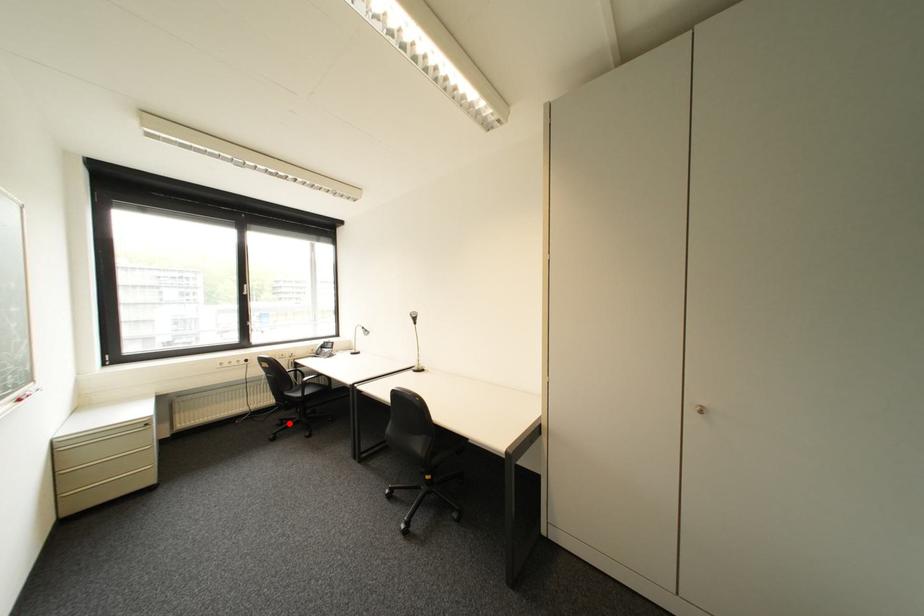
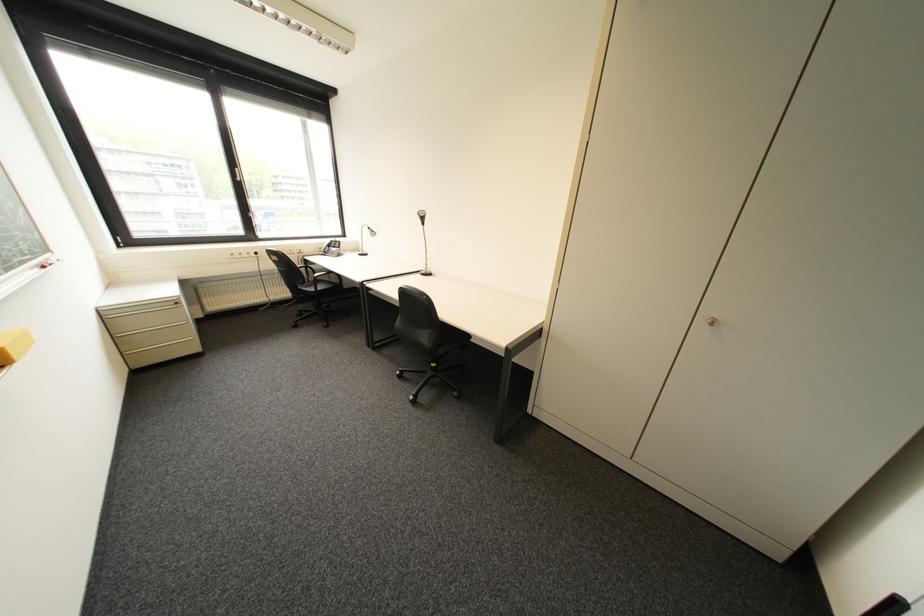
The point at the highlighted location is marked in the first image. Where is the corresponding point in the second image?

(309, 314)